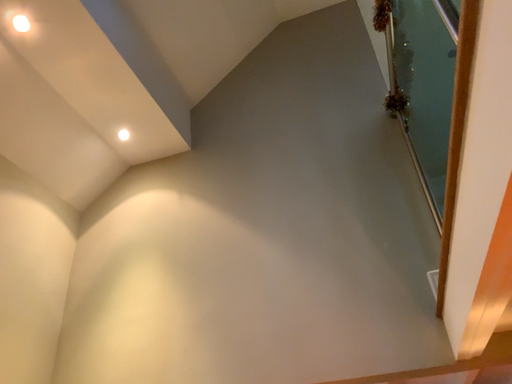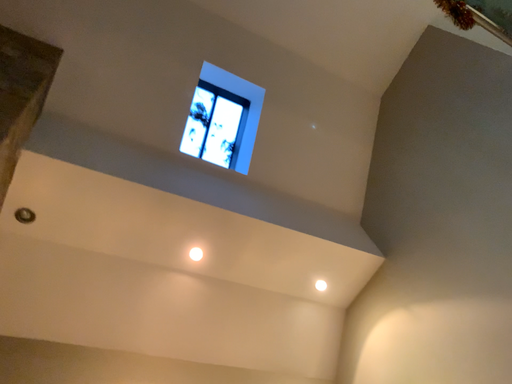
Question: How did the camera likely rotate when shooting the video?

Choices:
 (A) rotated right
 (B) rotated left

Answer: (B)